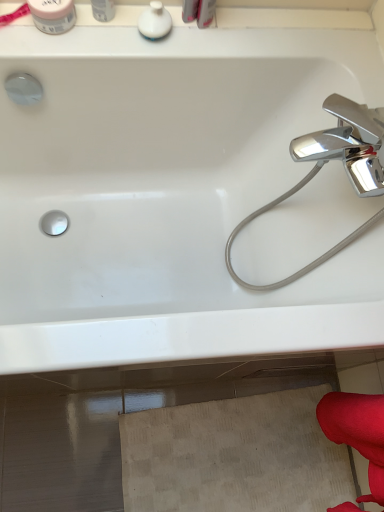
The width and height of the screenshot is (384, 512). What are the coordinates of `vacant area that lies to the right of white glossy container at upper left, acting as the 2th toiletry starting from the right` in the screenshot? It's located at (165, 40).